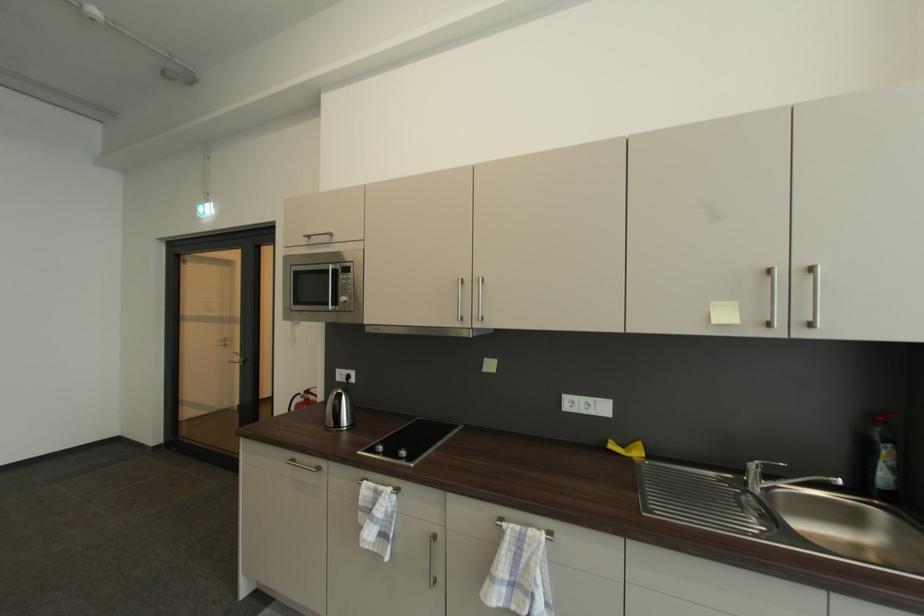
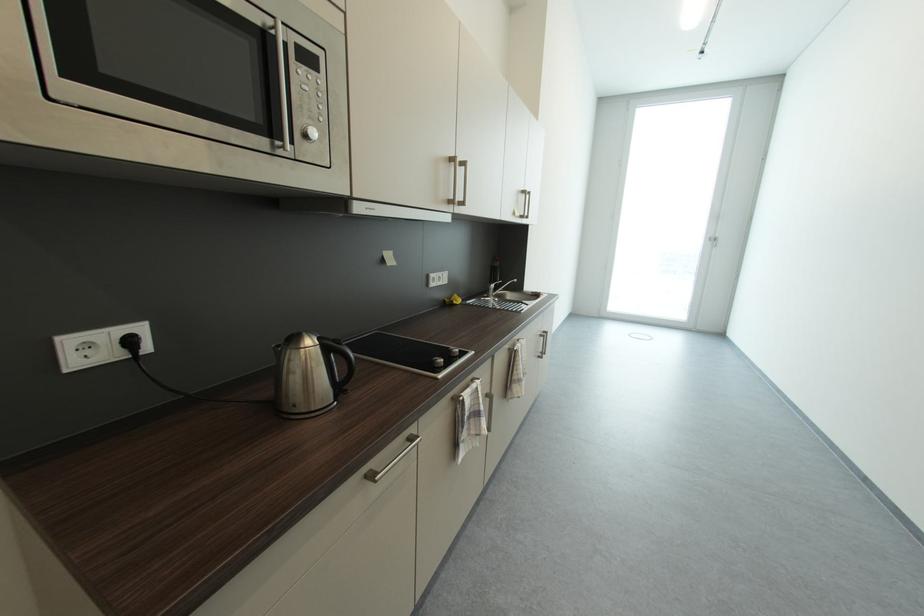
Find the pixel in the second image that matches point 613,443 in the first image.

(453, 302)